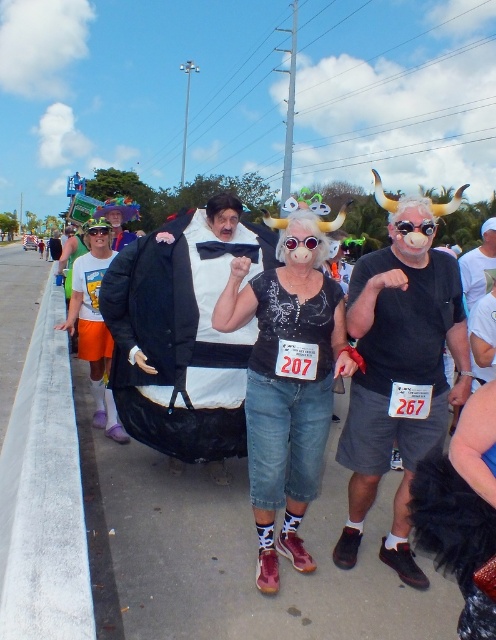
Question: Is denim jeans at center in front of orange cotton shorts at left?

Choices:
 (A) no
 (B) yes

Answer: (B)

Question: Which object is the closest to the black matte suit at center?

Choices:
 (A) denim shorts at center
 (B) black satin bed at center

Answer: (A)

Question: Which of the following is the closest to the observer?

Choices:
 (A) black matte t-shirt at center
 (B) black matte suit at center
 (C) denim jeans at center
 (D) matte white t-shirt at center

Answer: (A)

Question: Can you confirm if denim shorts at center is positioned to the left of denim jeans at center?

Choices:
 (A) no
 (B) yes

Answer: (B)

Question: Estimate the real-world distances between objects in this image. Which object is farther from the black satin bed at center?

Choices:
 (A) denim shorts at center
 (B) matte white t-shirt at center
 (C) black matte suit at center
 (D) denim jeans at center

Answer: (B)

Question: Is black satin bed at center above orange cotton shorts at left?

Choices:
 (A) no
 (B) yes

Answer: (B)